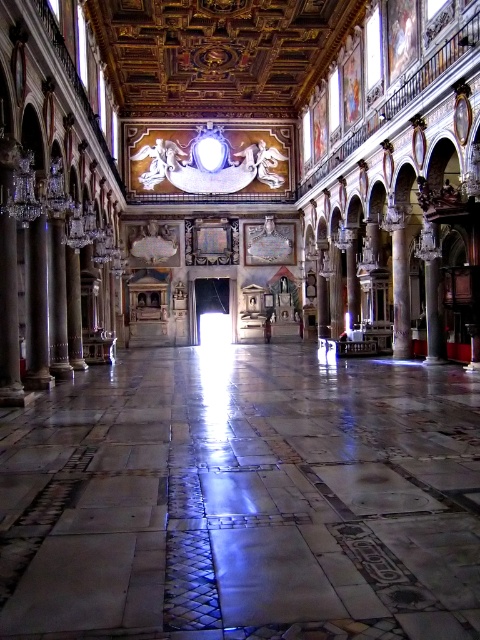
Does point (262, 356) come closer to viewer compared to point (350, 253)?

No, it is not.

Is white marble corridor at center taller than white marble pillar at center?

Incorrect, white marble corridor at center's height is not larger of white marble pillar at center's.

Where is `white marble corridor at center`? white marble corridor at center is located at coordinates (242, 499).

From the picture: Can you confirm if white marble corridor at center is shorter than marble column at center?

Correct, white marble corridor at center is not as tall as marble column at center.

Can you confirm if white marble corridor at center is smaller than marble column at center?

No.

At what (x,y) coordinates should I click in order to perform the action: click on white marble corridor at center. Please return your answer as a coordinate pair (x, y). Looking at the image, I should click on (242, 499).

Does white marble pillar at left appear under polished marble column at left?

Indeed, white marble pillar at left is positioned under polished marble column at left.

Which of these two, white marble pillar at left or polished marble column at left, stands shorter?

With less height is white marble pillar at left.

Who is more distant from viewer, (28, 236) or (64, 348)?

Point (64, 348)

This screenshot has height=640, width=480. Identify the location of white marble pillar at left. (36, 308).